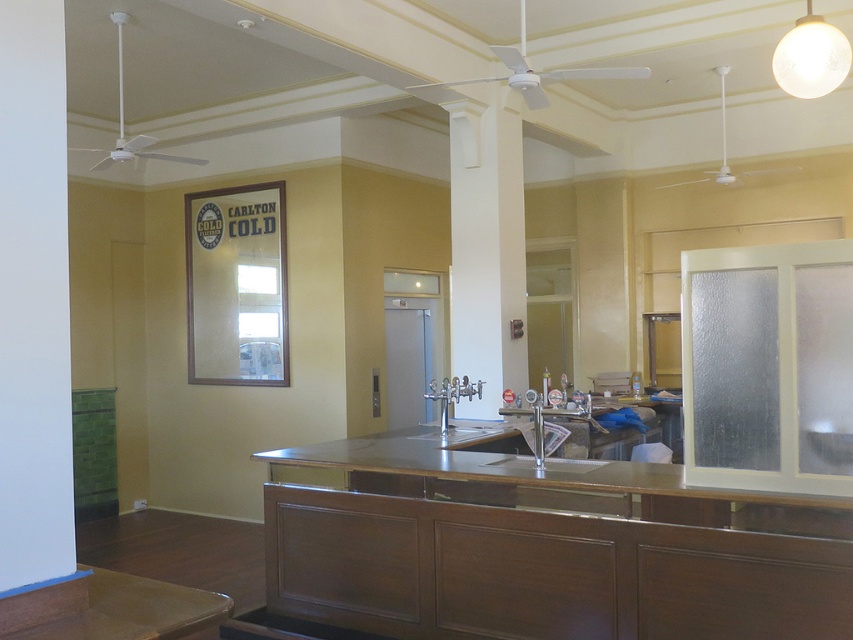
You are a bartender preparing to clean the bar. You need to wipe the stainless steel counter at center first before moving to the satin nickel faucet at center. Based on their positions, which direction should you move from the counter to the faucet?

The stainless steel counter at center is to the left of the satin nickel faucet at center, so you should move to the right to reach the faucet from the counter.

Looking at this image, you are a person who is 5 feet tall. You want to order a drink from the bar. Can you comfortably see over the stainless steel counter at center?

The stainless steel counter at center is 9.67 feet away from the viewer. Since the counter height isn not mentioned, but typically bar counters are around 48 inches tall, which is 4 feet. A person who is 5 feet tall would be able to see over the stainless steel counter at center comfortably.